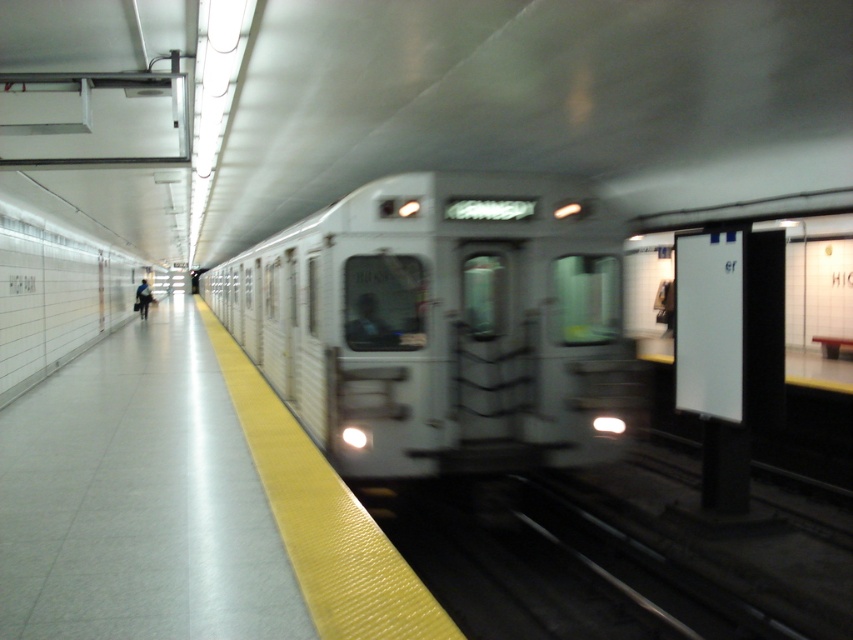
Question: Which point is closer to the camera?

Choices:
 (A) (143, 305)
 (B) (552, 420)

Answer: (B)

Question: Can you confirm if white glossy train at center is positioned above dark blue jacket at left?

Choices:
 (A) no
 (B) yes

Answer: (A)

Question: Is white glossy train at center positioned before dark blue jacket at left?

Choices:
 (A) no
 (B) yes

Answer: (B)

Question: Can you confirm if white glossy train at center is positioned below dark blue jacket at left?

Choices:
 (A) yes
 (B) no

Answer: (A)